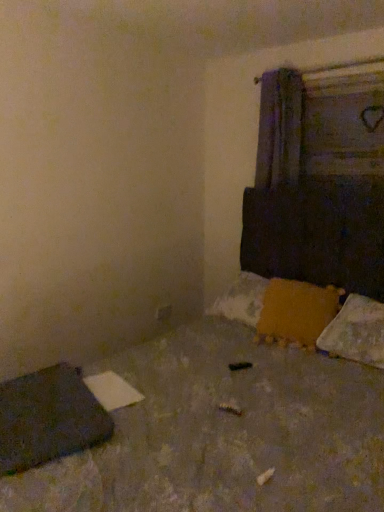
How much space does orange fuzzy pillow at lower right, arranged as the first pillow when viewed from the left, occupy horizontally?

orange fuzzy pillow at lower right, arranged as the first pillow when viewed from the left, is 39.35 centimeters in width.

What do you see at coordinates (48, 418) in the screenshot? I see `dark gray fabric at lower left` at bounding box center [48, 418].

Measure the distance between white fluffy pillow at lower right, which is counted as the 1th pillow, starting from the right, and camera.

A distance of 6.42 feet exists between white fluffy pillow at lower right, which is counted as the 1th pillow, starting from the right, and camera.

Where is `orange fuzzy pillow at lower right, the 2th pillow from the right`? This screenshot has width=384, height=512. orange fuzzy pillow at lower right, the 2th pillow from the right is located at coordinates (296, 312).

Is point (381, 333) in front of point (48, 394)?

No, (381, 333) is behind (48, 394).

From the image's perspective, which is above, white fluffy pillow at lower right, which is the second pillow from left to right, or dark gray fabric at lower left?

white fluffy pillow at lower right, which is the second pillow from left to right, appears higher in the image.

Does white fluffy pillow at lower right, which is the second pillow from left to right, have a larger size compared to dark gray fabric at lower left?

Yes.

Which is more to the left, white fluffy pillow at lower right, which is the second pillow from left to right, or dark gray fabric at lower left?

dark gray fabric at lower left.

From a real-world perspective, is dark gray fabric at lower left physically above concrete textured floor at lower left?

No, from a real-world perspective, dark gray fabric at lower left is not over concrete textured floor at lower left

Based on the photo, is dark gray fabric at lower left at the left side of concrete textured floor at lower left?

Indeed, dark gray fabric at lower left is positioned on the left side of concrete textured floor at lower left.

From the image's perspective, which one is positioned lower, dark gray fabric at lower left or concrete textured floor at lower left?

dark gray fabric at lower left appears lower in the image.

From the image's perspective, is concrete textured floor at lower left below orange fuzzy pillow at lower right, the 2th pillow from the right?

Yes, from the image's perspective, concrete textured floor at lower left is below orange fuzzy pillow at lower right, the 2th pillow from the right.

Are concrete textured floor at lower left and orange fuzzy pillow at lower right, the 2th pillow from the right, located far from each other?

concrete textured floor at lower left is near orange fuzzy pillow at lower right, the 2th pillow from the right, not far away.

Is point (47, 495) behind point (312, 344)?

No, it is in front of (312, 344).

Is point (293, 328) closer or farther from the camera than point (35, 399)?

Point (293, 328) is positioned farther from the camera compared to point (35, 399).

Consider the image. Based on their sizes in the image, would you say orange fuzzy pillow at lower right, arranged as the first pillow when viewed from the left, is bigger or smaller than dark gray fabric at lower left?

Clearly, orange fuzzy pillow at lower right, arranged as the first pillow when viewed from the left, is larger in size than dark gray fabric at lower left.

In the image, is orange fuzzy pillow at lower right, the 2th pillow from the right, positioned in front of or behind dark gray fabric at lower left?

Visually, orange fuzzy pillow at lower right, the 2th pillow from the right, is located behind dark gray fabric at lower left.

Is dark gray fabric at lower left surrounded by orange fuzzy pillow at lower right, the 2th pillow from the right?

Actually, dark gray fabric at lower left is outside orange fuzzy pillow at lower right, the 2th pillow from the right.

Locate an element on the screen. The height and width of the screenshot is (512, 384). the 2nd pillow behind the dark gray fabric at lower left is located at coordinates (296, 312).

Can you confirm if dark gray fabric at lower left is taller than orange fuzzy pillow at lower right, the 2th pillow from the right?

Incorrect, the height of dark gray fabric at lower left is not larger of that of orange fuzzy pillow at lower right, the 2th pillow from the right.

Is dark gray fabric at lower left in contact with orange fuzzy pillow at lower right, the 2th pillow from the right?

No, dark gray fabric at lower left is not with orange fuzzy pillow at lower right, the 2th pillow from the right.

Which object is wider, white fluffy pillow at lower right, which is the second pillow from left to right, or orange fuzzy pillow at lower right, the 2th pillow from the right?

white fluffy pillow at lower right, which is the second pillow from left to right, is wider.

Is white fluffy pillow at lower right, which is counted as the 1th pillow, starting from the right, directly adjacent to orange fuzzy pillow at lower right, the 2th pillow from the right?

No, white fluffy pillow at lower right, which is counted as the 1th pillow, starting from the right, is not beside orange fuzzy pillow at lower right, the 2th pillow from the right.

Considering the points (348, 339) and (293, 318), which point is behind, point (348, 339) or point (293, 318)?

The point (293, 318) is farther.

How different are the orientations of orange fuzzy pillow at lower right, arranged as the first pillow when viewed from the left, and white fluffy pillow at lower right, which is the second pillow from left to right, in degrees?

The facing directions of orange fuzzy pillow at lower right, arranged as the first pillow when viewed from the left, and white fluffy pillow at lower right, which is the second pillow from left to right, are 18.1 degrees apart.

Between orange fuzzy pillow at lower right, arranged as the first pillow when viewed from the left, and white fluffy pillow at lower right, which is counted as the 1th pillow, starting from the right, which one is positioned behind?

Positioned behind is orange fuzzy pillow at lower right, arranged as the first pillow when viewed from the left.

Is white fluffy pillow at lower right, which is the second pillow from left to right, completely or partially inside orange fuzzy pillow at lower right, arranged as the first pillow when viewed from the left?

No, white fluffy pillow at lower right, which is the second pillow from left to right, is not inside orange fuzzy pillow at lower right, arranged as the first pillow when viewed from the left.

From the image's perspective, which one is positioned lower, orange fuzzy pillow at lower right, arranged as the first pillow when viewed from the left, or white fluffy pillow at lower right, which is the second pillow from left to right?

white fluffy pillow at lower right, which is the second pillow from left to right, from the image's perspective.

Where is `the 1st pillow behind the dark gray fabric at lower left`? Image resolution: width=384 pixels, height=512 pixels. the 1st pillow behind the dark gray fabric at lower left is located at coordinates (356, 332).

The width and height of the screenshot is (384, 512). In the image, there is a concrete textured floor at lower left. What are the coordinates of `pad below it (from a real-world perspective)` in the screenshot? It's located at tap(48, 418).

Considering their positions, is dark gray fabric at lower left positioned closer to concrete textured floor at lower left than orange fuzzy pillow at lower right, arranged as the first pillow when viewed from the left?

Among the two, dark gray fabric at lower left is located nearer to concrete textured floor at lower left.

Estimate the real-world distances between objects in this image. Which object is further from white fluffy pillow at lower right, which is counted as the 1th pillow, starting from the right, dark gray fabric at lower left or concrete textured floor at lower left?

dark gray fabric at lower left.

Considering their positions, is orange fuzzy pillow at lower right, the 2th pillow from the right, positioned further to dark gray fabric at lower left than concrete textured floor at lower left?

orange fuzzy pillow at lower right, the 2th pillow from the right, is further to dark gray fabric at lower left.

From the image, which object appears to be nearer to dark gray fabric at lower left, concrete textured floor at lower left or white fluffy pillow at lower right, which is counted as the 1th pillow, starting from the right?

concrete textured floor at lower left is positioned closer to the anchor dark gray fabric at lower left.

Based on their spatial positions, is white fluffy pillow at lower right, which is counted as the 1th pillow, starting from the right, or dark gray fabric at lower left closer to orange fuzzy pillow at lower right, the 2th pillow from the right?

white fluffy pillow at lower right, which is counted as the 1th pillow, starting from the right, is closer to orange fuzzy pillow at lower right, the 2th pillow from the right.

Estimate the real-world distances between objects in this image. Which object is closer to dark gray fabric at lower left, concrete textured floor at lower left or orange fuzzy pillow at lower right, arranged as the first pillow when viewed from the left?

The object closer to dark gray fabric at lower left is concrete textured floor at lower left.

Estimate the real-world distances between objects in this image. Which object is closer to orange fuzzy pillow at lower right, the 2th pillow from the right, concrete textured floor at lower left or dark gray fabric at lower left?

concrete textured floor at lower left lies closer to orange fuzzy pillow at lower right, the 2th pillow from the right, than the other object.

Which object lies nearer to the anchor point white fluffy pillow at lower right, which is the second pillow from left to right, dark gray fabric at lower left or orange fuzzy pillow at lower right, arranged as the first pillow when viewed from the left?

orange fuzzy pillow at lower right, arranged as the first pillow when viewed from the left.

Identify the location of pillow between concrete textured floor at lower left and orange fuzzy pillow at lower right, the 2th pillow from the right, in the front-back direction. (356, 332).

Find the location of a particular element. pillow between dark gray fabric at lower left and white fluffy pillow at lower right, which is the second pillow from left to right, from left to right is located at coordinates (296, 312).

Locate an element on the screen. This screenshot has width=384, height=512. pad between concrete textured floor at lower left and orange fuzzy pillow at lower right, the 2th pillow from the right, along the z-axis is located at coordinates (48, 418).

Locate an element on the screen. This screenshot has width=384, height=512. pad between concrete textured floor at lower left and white fluffy pillow at lower right, which is the second pillow from left to right, along the z-axis is located at coordinates (48, 418).